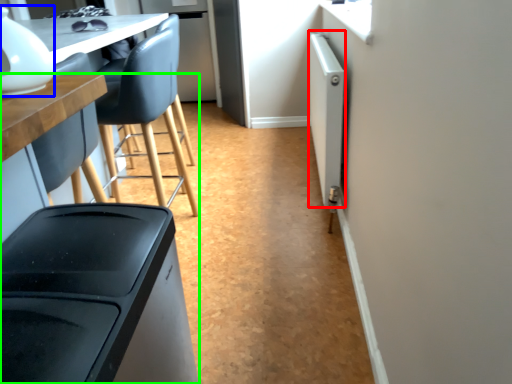
Question: Which is nearer to the appliance (highlighted by a red box)? appliance (highlighted by a blue box) or table (highlighted by a green box).

Choices:
 (A) appliance
 (B) table

Answer: (B)